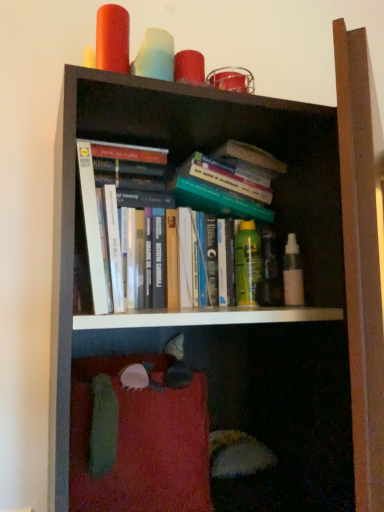
Describe the element at coordinates (293, 273) in the screenshot. This screenshot has width=384, height=512. I see `white matte spray bottle at center right, positioned as the 1th toiletry in front-to-back order` at that location.

How much space does white matte spray bottle at center right, positioned as the 1th toiletry in front-to-back order, occupy horizontally?

white matte spray bottle at center right, positioned as the 1th toiletry in front-to-back order, is 1.97 inches wide.

At what (x,y) coordinates should I click in order to perform the action: click on white matte spray bottle at center right, acting as the 1th toiletry starting from the right. Please return your answer as a coordinate pair (x, y). This screenshot has width=384, height=512. Looking at the image, I should click on (293, 273).

Is white paperbacks at center outside of white matte spray bottle at center right, positioned as the 1th toiletry in front-to-back order?

Absolutely, white paperbacks at center is external to white matte spray bottle at center right, positioned as the 1th toiletry in front-to-back order.

Considering the relative sizes of white paperbacks at center and white matte spray bottle at center right, positioned as the 1th toiletry in front-to-back order, in the image provided, is white paperbacks at center shorter than white matte spray bottle at center right, positioned as the 1th toiletry in front-to-back order,?

No, white paperbacks at center is not shorter than white matte spray bottle at center right, positioned as the 1th toiletry in front-to-back order.

Identify the location of book above the white matte spray bottle at center right, acting as the 1th toiletry starting from the right (from the image's perspective). The width and height of the screenshot is (384, 512). (117, 216).

Are white matte spray bottle at center right, arranged as the 2th toiletry when viewed from the left, and white paperbacks at center far apart?

white matte spray bottle at center right, arranged as the 2th toiletry when viewed from the left, is actually quite close to white paperbacks at center.

Is white matte spray bottle at center right, arranged as the 2th toiletry when viewed from the left, inside the boundaries of white paperbacks at center, or outside?

white matte spray bottle at center right, arranged as the 2th toiletry when viewed from the left, is outside white paperbacks at center.

Which point is more forward, (x=291, y=266) or (x=146, y=192)?

The point (x=146, y=192) is closer to the camera.

In order to click on book located above the green matte spray can at center, the 2th toiletry positioned from the right (from a real-world perspective) in this screenshot , I will do `click(117, 216)`.

Which object is more forward, white paperbacks at center or green matte spray can at center, which is the first toiletry in left-to-right order?

white paperbacks at center is closer to the camera.

Who is bigger, white paperbacks at center or green matte spray can at center, which is the first toiletry in left-to-right order?

white paperbacks at center.

Is point (249, 281) closer or farther from the camera than point (134, 234)?

Point (249, 281).

From the image's perspective, which toiletry is the 2nd one below the white paperbacks at center? Please provide its 2D coordinates.

[(247, 263)]

Considering the relative sizes of green matte spray can at center, arranged as the first toiletry when viewed from the back, and white paperbacks at center in the image provided, is green matte spray can at center, arranged as the first toiletry when viewed from the back, smaller than white paperbacks at center?

Correct, green matte spray can at center, arranged as the first toiletry when viewed from the back, occupies less space than white paperbacks at center.

From a real-world perspective, relative to white matte spray bottle at center right, positioned as the 1th toiletry in front-to-back order, is green matte spray can at center, the 2th toiletry positioned from the right, vertically above or below?

From a real-world perspective, green matte spray can at center, the 2th toiletry positioned from the right, is physically above white matte spray bottle at center right, positioned as the 1th toiletry in front-to-back order.

Is white matte spray bottle at center right, positioned as the 1th toiletry in front-to-back order, inside green matte spray can at center, the 2th toiletry positioned from the right?

No, white matte spray bottle at center right, positioned as the 1th toiletry in front-to-back order, is not surrounded by green matte spray can at center, the 2th toiletry positioned from the right.

Does white matte spray bottle at center right, marked as the second toiletry in a back-to-front arrangement, have a lesser height compared to green matte spray can at center, the 2th toiletry positioned from the right?

Yes, white matte spray bottle at center right, marked as the second toiletry in a back-to-front arrangement, is shorter than green matte spray can at center, the 2th toiletry positioned from the right.

Is point (290, 274) behind point (252, 222)?

That is False.

Is white matte spray bottle at center right, positioned as the 1th toiletry in front-to-back order, inside or outside of green matte spray can at center, which is the first toiletry in left-to-right order?

white matte spray bottle at center right, positioned as the 1th toiletry in front-to-back order, cannot be found inside green matte spray can at center, which is the first toiletry in left-to-right order.

The width and height of the screenshot is (384, 512). Find the location of `book in front of the white matte spray bottle at center right, marked as the second toiletry in a back-to-front arrangement`. book in front of the white matte spray bottle at center right, marked as the second toiletry in a back-to-front arrangement is located at coordinates (117, 216).

From the image's perspective, count 1st toiletrys downward from the white paperbacks at center and point to it. Please provide its 2D coordinates.

[(293, 273)]

When comparing their distances from green matte spray can at center, arranged as the first toiletry when viewed from the back, does white matte spray bottle at center right, positioned as the 1th toiletry in front-to-back order, or white paperbacks at center seem further?

Among the two, white paperbacks at center is located further to green matte spray can at center, arranged as the first toiletry when viewed from the back.

From the image, which object appears to be nearer to white matte spray bottle at center right, positioned as the 1th toiletry in front-to-back order, green matte spray can at center, the 2th toiletry positioned from the right, or white paperbacks at center?

Based on the image, green matte spray can at center, the 2th toiletry positioned from the right, appears to be nearer to white matte spray bottle at center right, positioned as the 1th toiletry in front-to-back order.

Which object lies further to the anchor point green matte spray can at center, arranged as the first toiletry when viewed from the back, white paperbacks at center or white matte spray bottle at center right, arranged as the 2th toiletry when viewed from the left?

white paperbacks at center lies further to green matte spray can at center, arranged as the first toiletry when viewed from the back, than the other object.

From the image, which object appears to be nearer to white paperbacks at center, green matte spray can at center, arranged as the first toiletry when viewed from the back, or white matte spray bottle at center right, acting as the 1th toiletry starting from the right?

green matte spray can at center, arranged as the first toiletry when viewed from the back.

Looking at the image, which one is located closer to white paperbacks at center, white matte spray bottle at center right, arranged as the 2th toiletry when viewed from the left, or green matte spray can at center, the 2th toiletry positioned from the right?

green matte spray can at center, the 2th toiletry positioned from the right, lies closer to white paperbacks at center than the other object.

When comparing their distances from white matte spray bottle at center right, arranged as the 2th toiletry when viewed from the left, does white paperbacks at center or green matte spray can at center, the 2th toiletry positioned from the right, seem closer?

The object closer to white matte spray bottle at center right, arranged as the 2th toiletry when viewed from the left, is green matte spray can at center, the 2th toiletry positioned from the right.

I want to click on toiletry located between white paperbacks at center and white matte spray bottle at center right, marked as the second toiletry in a back-to-front arrangement, in the left-right direction, so click(x=247, y=263).